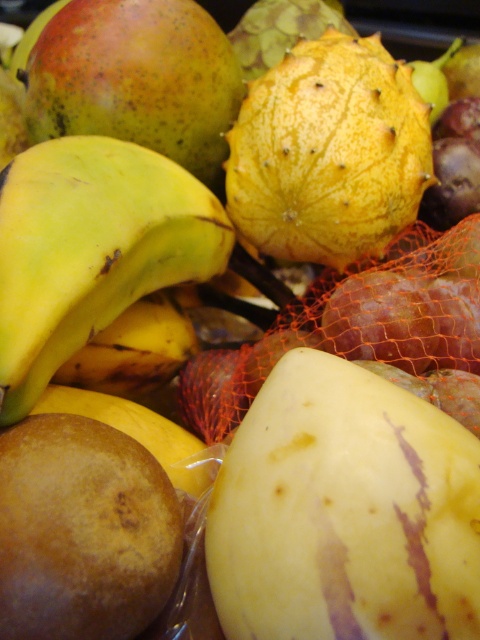
Question: Which object is farther from the camera taking this photo?

Choices:
 (A) brown matte potato at lower left
 (B) yellow spiky fruit at center

Answer: (B)

Question: Does yellow matte banana at left lie behind yellow spiky fruit at center?

Choices:
 (A) yes
 (B) no

Answer: (B)

Question: Can you confirm if yellow spiky fruit at center is positioned above brown matte potato at lower left?

Choices:
 (A) yes
 (B) no

Answer: (A)

Question: Is yellow spiky fruit at center smaller than brown matte potato at lower left?

Choices:
 (A) yes
 (B) no

Answer: (B)

Question: Which point appears closest to the camera in this image?

Choices:
 (A) (28, 493)
 (B) (336, 225)
 (C) (180, 182)

Answer: (A)

Question: Which of the following is the closest to the observer?

Choices:
 (A) (24, 161)
 (B) (344, 56)
 (C) (36, 561)

Answer: (C)